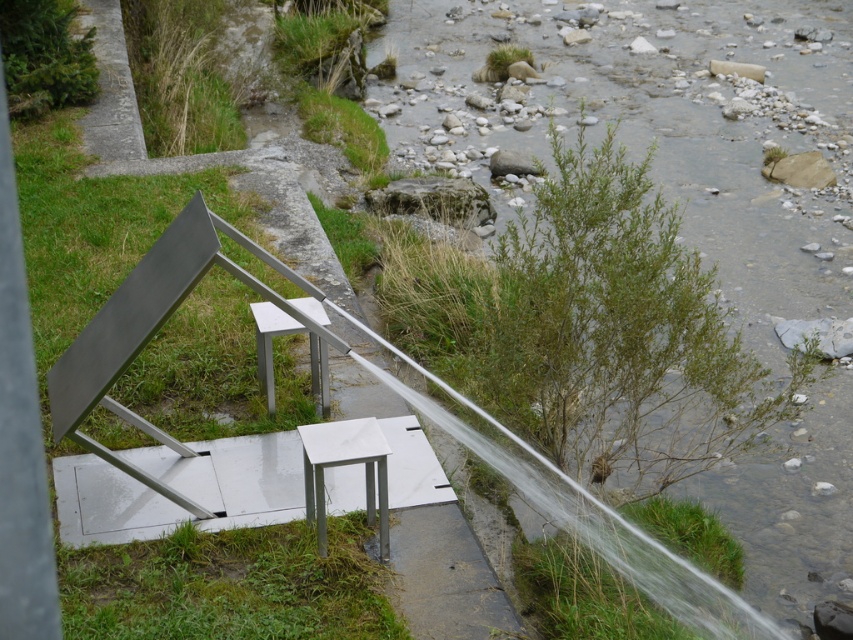
Between white marble stool at center and metallic silver stool at center, which one has more height?

Standing taller between the two is metallic silver stool at center.

In the scene shown: Which is below, white marble stool at center or metallic silver stool at center?

white marble stool at center is below.

Locate an element on the screen. white marble stool at center is located at coordinates (345, 465).

Find the location of a particular element. white marble stool at center is located at coordinates (345, 465).